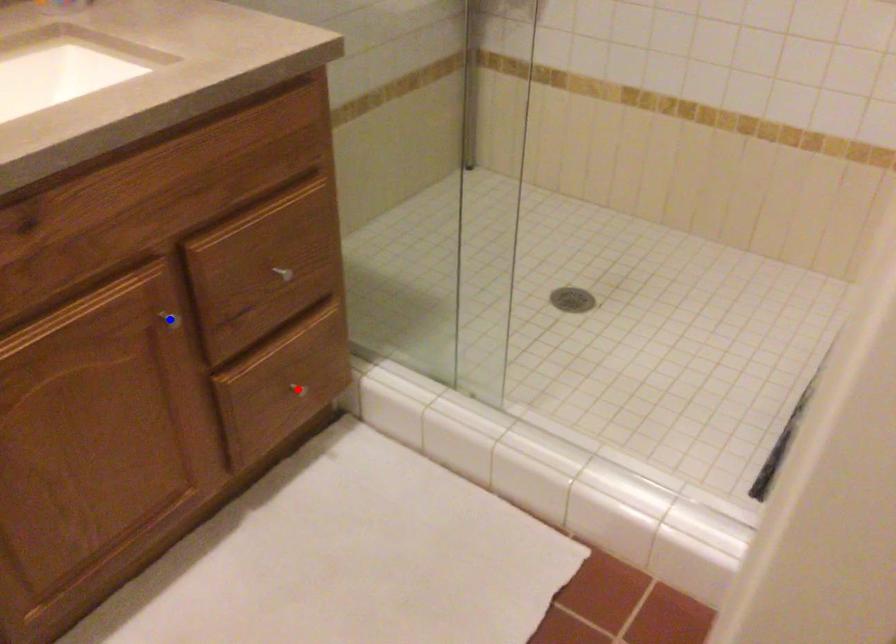
Question: In the image, two points are highlighted. Which point is nearer to the camera? Reply with the corresponding letter.

Choices:
 (A) blue point
 (B) red point

Answer: (A)